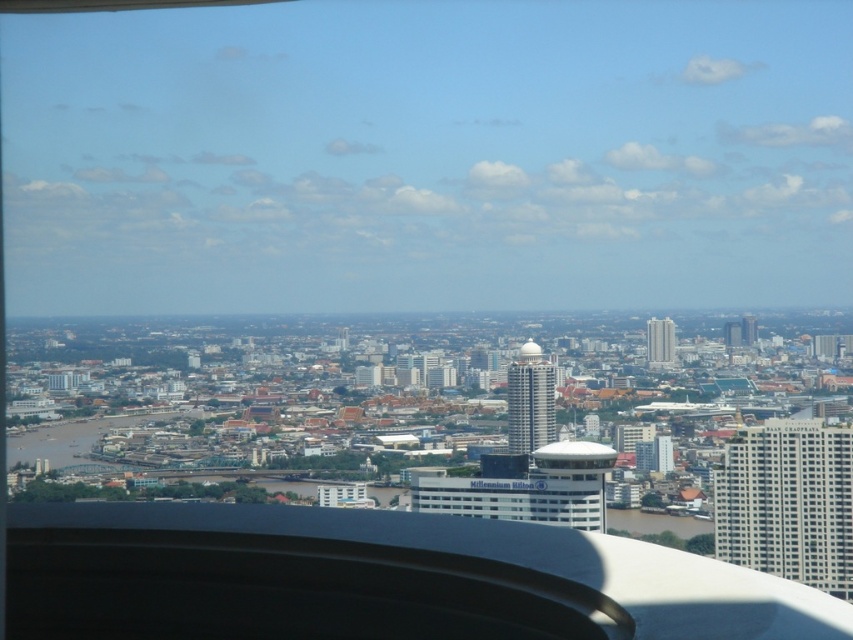
Question: Can you confirm if gray concrete tower at center is positioned above matte gray skyscraper at center-right?

Choices:
 (A) no
 (B) yes

Answer: (A)

Question: Which of these objects is positioned closest to the white glass building at center?

Choices:
 (A) matte gray skyscraper at center-right
 (B) gray concrete tower at center
 (C) matte glass skyscraper at center-right
 (D) matte gray skyscraper at right

Answer: (B)

Question: Does white glass building at center appear under matte gray skyscraper at right?

Choices:
 (A) no
 (B) yes

Answer: (B)

Question: Which is nearer to the matte gray skyscraper at right?

Choices:
 (A) white glass building at center
 (B) gray concrete tower at center
 (C) matte glass skyscraper at center-right
 (D) matte gray skyscraper at center-right

Answer: (C)

Question: Can you confirm if matte gray skyscraper at right is positioned to the right of matte glass skyscraper at center-right?

Choices:
 (A) yes
 (B) no

Answer: (A)

Question: Which of these objects is positioned farthest from the gray concrete tower at center?

Choices:
 (A) matte glass skyscraper at center-right
 (B) matte gray skyscraper at right
 (C) white glass building at center

Answer: (B)